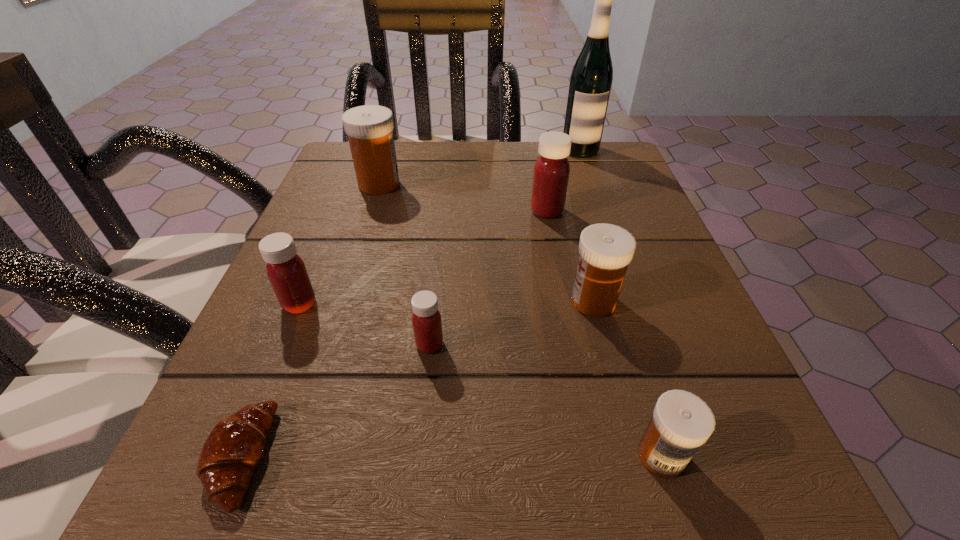
This screenshot has width=960, height=540. Identify the location of the tallest object. (591, 78).

Image resolution: width=960 pixels, height=540 pixels. I want to click on the farthest object, so click(591, 78).

Where is `the farthest white medicine`? This screenshot has height=540, width=960. the farthest white medicine is located at coordinates (369, 128).

In order to click on the farthest medicine in this screenshot , I will do `click(369, 128)`.

Where is `the farthest red medicine`? the farthest red medicine is located at coordinates 551,173.

The height and width of the screenshot is (540, 960). I want to click on the rightmost red medicine, so click(x=551, y=173).

Where is `the second farthest white medicine`? This screenshot has width=960, height=540. the second farthest white medicine is located at coordinates (605, 250).

Locate an element on the screen. The image size is (960, 540). the leftmost red medicine is located at coordinates (286, 271).

At what (x,y) coordinates should I click in order to perform the action: click on the second nearest red medicine. Please return your answer as a coordinate pair (x, y). The width and height of the screenshot is (960, 540). Looking at the image, I should click on (286, 271).

You are a GUI agent. You are given a task and a screenshot of the screen. Output one action in this format:
    pyautogui.click(x=<x>, y=<y>)
    Task: Click on the fifth farthest medicine
    
    Given the screenshot: What is the action you would take?
    pyautogui.click(x=427, y=324)